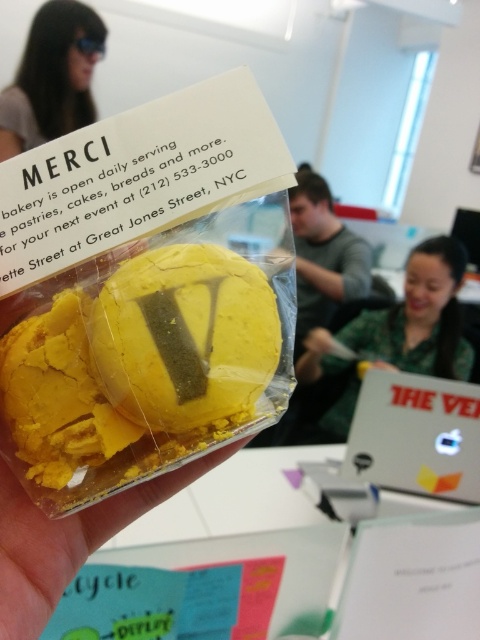
Who is taller, green matte shirt at center or matte black sunglasses at upper left?

Standing taller between the two is green matte shirt at center.

Is green matte shirt at center behind matte black sunglasses at upper left?

No, green matte shirt at center is in front of matte black sunglasses at upper left.

Who is more distant from viewer, (315,340) or (32,145)?

Positioned behind is point (315,340).

At what (x,y) coordinates should I click in order to perform the action: click on green matte shirt at center. Please return your answer as a coordinate pair (x, y). Image resolution: width=480 pixels, height=640 pixels. Looking at the image, I should click on (419, 317).

Does yellow crumbly pastry at center appear on the left side of green matte shirt at center?

Yes, yellow crumbly pastry at center is to the left of green matte shirt at center.

Does point (40, 417) come closer to viewer compared to point (458, 252)?

Yes.

Is point (206, 404) positioned before point (320, 436)?

Yes.

At what (x,y) coordinates should I click in order to perform the action: click on yellow crumbly pastry at center. Please return your answer as a coordinate pair (x, y). Image resolution: width=480 pixels, height=640 pixels. Looking at the image, I should click on (136, 369).

Is yellow crumbly pastry at center to the right of green fabric shirt at upper center from the viewer's perspective?

Incorrect, yellow crumbly pastry at center is not on the right side of green fabric shirt at upper center.

Which is in front, point (203, 248) or point (331, 285)?

Point (203, 248) is more forward.

I want to click on yellow crumbly pastry at center, so click(136, 369).